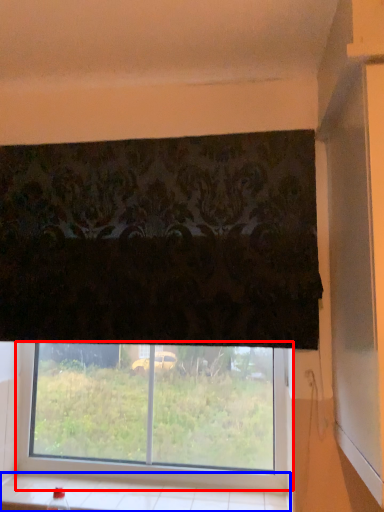
Question: Among these objects, which one is nearest to the camera, window (highlighted by a red box) or window sill (highlighted by a blue box)?

Choices:
 (A) window
 (B) window sill

Answer: (B)